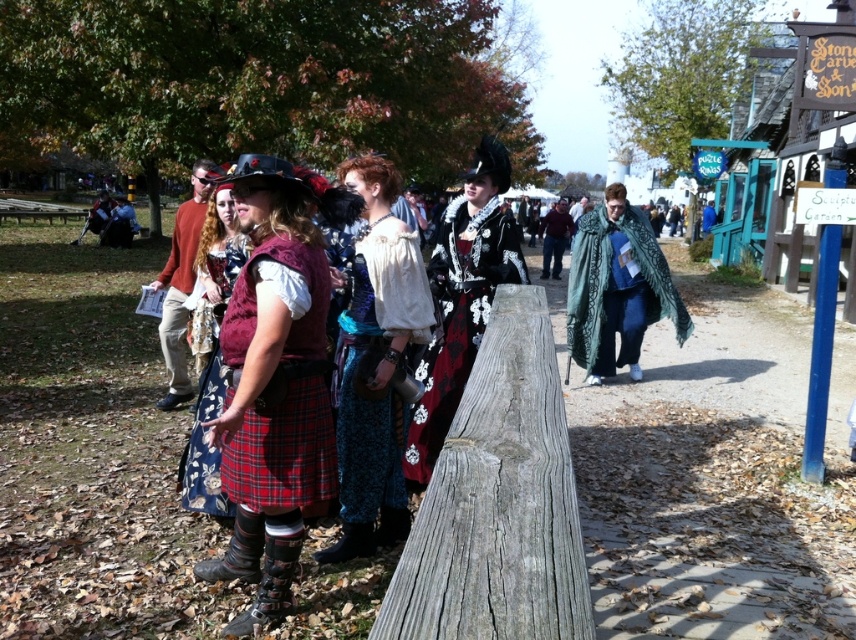
Is green textured cloak at center positioned before blue fabric coat at center?

That is True.

Between green textured cloak at center and blue fabric coat at center, which one has less height?

Standing shorter between the two is blue fabric coat at center.

The height and width of the screenshot is (640, 856). Identify the location of green textured cloak at center. (617, 289).

Locate an element on the screen. The width and height of the screenshot is (856, 640). green textured cloak at center is located at coordinates (617, 289).

Based on the photo, between velvet blue dress at center and floral fabric skirt at center, which one has less height?

floral fabric skirt at center

Which is behind, point (393, 195) or point (195, 420)?

Positioned behind is point (195, 420).

The image size is (856, 640). Find the location of `velvet blue dress at center`. velvet blue dress at center is located at coordinates (375, 364).

Image resolution: width=856 pixels, height=640 pixels. What are the coordinates of `velvet blue dress at center` in the screenshot? It's located at (375, 364).